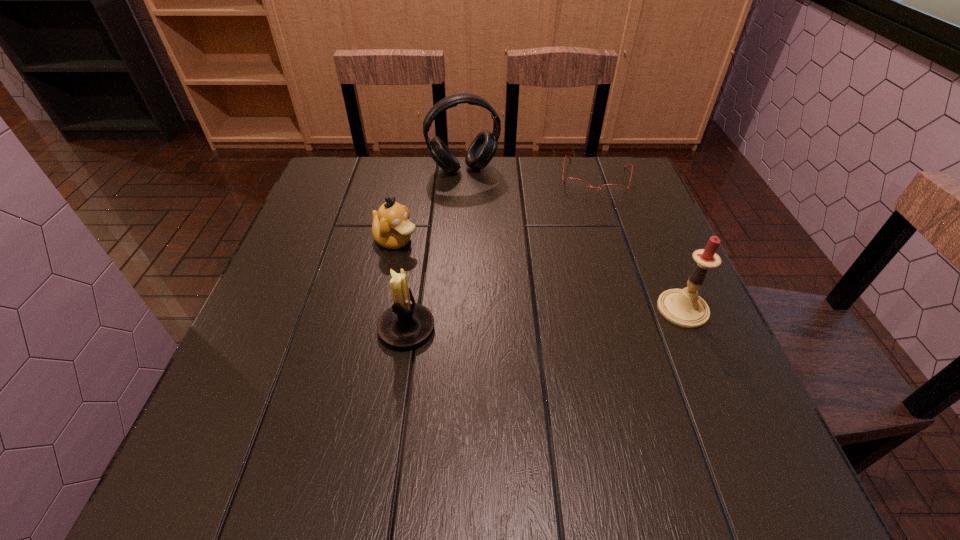
The width and height of the screenshot is (960, 540). What are the coordinates of `spectacles at the right edge` in the screenshot? It's located at (576, 185).

The height and width of the screenshot is (540, 960). I want to click on object that is positioned at the far right corner, so click(x=576, y=185).

Where is `vacant space at the far edge of the desktop`? This screenshot has width=960, height=540. vacant space at the far edge of the desktop is located at coordinates (445, 202).

I want to click on free location at the near edge, so click(x=587, y=392).

In the image, there is a desktop. Where is `vacant space at the left edge`? This screenshot has width=960, height=540. vacant space at the left edge is located at coordinates (249, 366).

You are a GUI agent. You are given a task and a screenshot of the screen. Output one action in this format:
    pyautogui.click(x=<x>, y=<y>)
    Task: Click on the vacant region at the right edge of the desktop
    Image resolution: width=960 pixels, height=540 pixels.
    Given the screenshot: What is the action you would take?
    pyautogui.click(x=679, y=330)

Locate an element on the screen. The width and height of the screenshot is (960, 540). free region at the far left corner is located at coordinates (342, 161).

You are a GUI agent. You are given a task and a screenshot of the screen. Output one action in this format:
    pyautogui.click(x=<x>, y=<y>)
    Task: Click on the vacant space at the near left corner of the desktop
    
    Given the screenshot: What is the action you would take?
    pyautogui.click(x=312, y=392)

Where is `free space at the far right corner of the desktop`? This screenshot has height=540, width=960. free space at the far right corner of the desktop is located at coordinates (614, 167).

The width and height of the screenshot is (960, 540). Find the location of `free spot between the candle holder and the candle`. free spot between the candle holder and the candle is located at coordinates (544, 319).